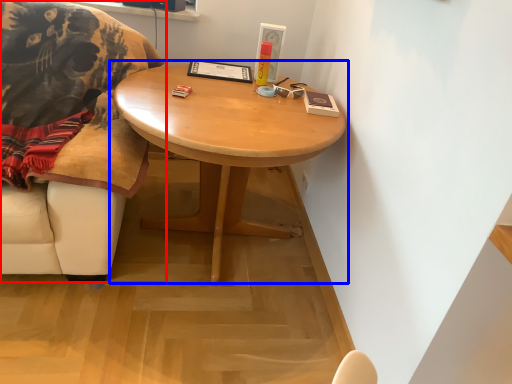
Question: Which object is closer to the camera taking this photo, chair (highlighted by a red box) or coffee table (highlighted by a blue box)?

Choices:
 (A) chair
 (B) coffee table

Answer: (A)